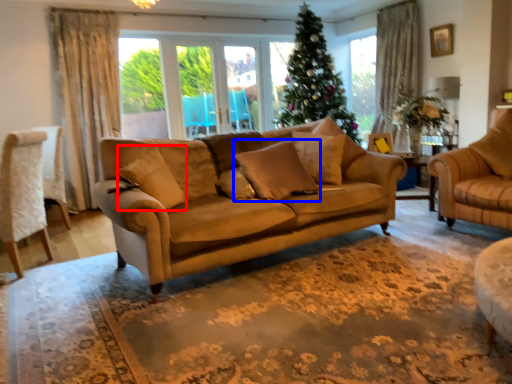
Question: Which object is further to the camera taking this photo, pillow (highlighted by a red box) or pillow (highlighted by a blue box)?

Choices:
 (A) pillow
 (B) pillow

Answer: (B)